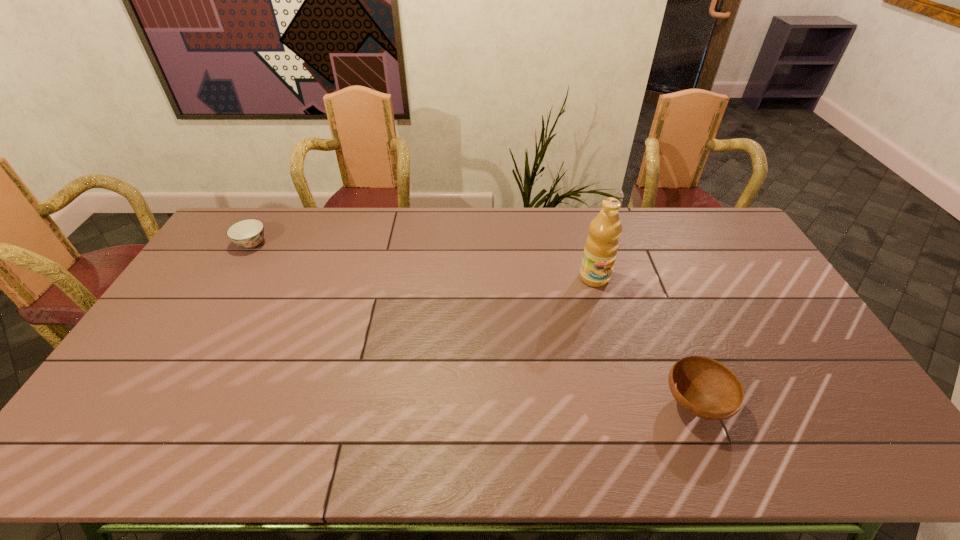
At what (x,y) coordinates should I click in order to perform the action: click on vacant space that satisfies the following two spatial constraints: 1. on the label of the nearest object; 2. on the left side of the olive oil. Please return your answer as a coordinate pair (x, y). The width and height of the screenshot is (960, 540). Looking at the image, I should click on (629, 403).

Image resolution: width=960 pixels, height=540 pixels. Identify the location of free space in the image that satisfies the following two spatial constraints: 1. on the label of the bowl; 2. on the left side of the olive oil. (629, 403).